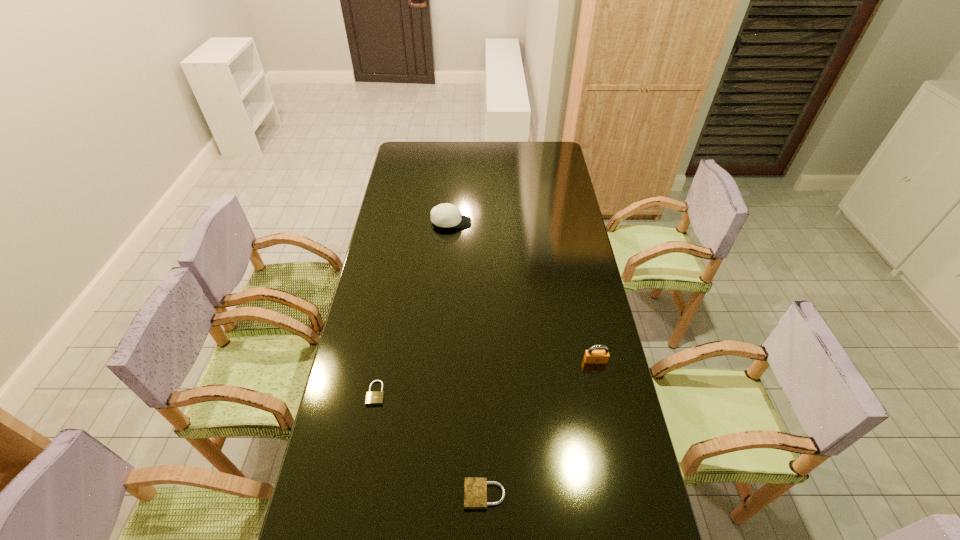
You are a GUI agent. You are given a task and a screenshot of the screen. Output one action in this format:
    pyautogui.click(x=<x>, y=<y>)
    Task: Click on the object that is the closest to the leftmost padlock
    This screenshot has height=540, width=960.
    Given the screenshot: What is the action you would take?
    (x=475, y=488)

Choose which object is the nearest neighbor to the tallest padlock. Please provide its 2D coordinates. Your answer should be formatted as a tuple, i.e. [(x, y)], where the tuple contains the x and y coordinates of a point satisfying the conditions above.

[(475, 488)]

Find the location of `padlock that is the third nearest to the farthest object`. padlock that is the third nearest to the farthest object is located at coordinates (475, 488).

Locate which padlock ranks in proximity to the baseball cap. Please provide its 2D coordinates. Your answer should be formatted as a tuple, i.e. [(x, y)], where the tuple contains the x and y coordinates of a point satisfying the conditions above.

[(372, 398)]

You are a GUI agent. You are given a task and a screenshot of the screen. Output one action in this format:
    pyautogui.click(x=<x>, y=<y>)
    Task: Click on the free point that satisfies the following two spatial constraints: 1. to unlock the rightmost padlock from the front; 2. on the keyhole side of the second padlock from right to left
    This screenshot has height=540, width=960.
    Given the screenshot: What is the action you would take?
    pyautogui.click(x=624, y=495)

Find the location of `free space in the image that satisfies the following two spatial constraints: 1. to unlock the tallest padlock from the front; 2. on the keyhole side of the second padlock from left to right`. free space in the image that satisfies the following two spatial constraints: 1. to unlock the tallest padlock from the front; 2. on the keyhole side of the second padlock from left to right is located at coordinates (624, 495).

At what (x,y) coordinates should I click in order to perform the action: click on vacant region that satisfies the following two spatial constraints: 1. to unlock the farthest padlock from the front; 2. on the keyhole side of the second tallest padlock. Please return your answer as a coordinate pair (x, y). This screenshot has height=540, width=960. Looking at the image, I should click on (624, 495).